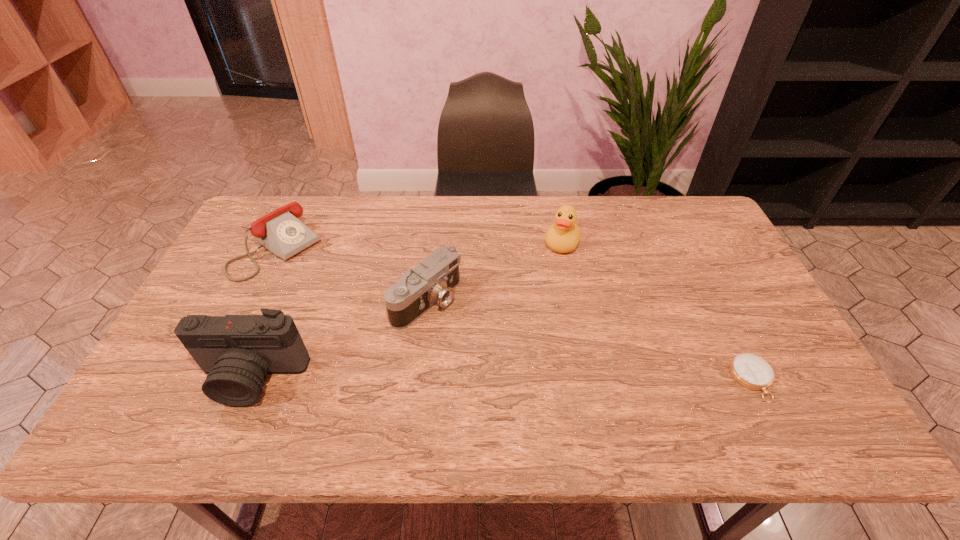
This screenshot has width=960, height=540. I want to click on vacant area at the left edge, so click(232, 274).

The width and height of the screenshot is (960, 540). Find the location of `free spot at the right edge of the desktop`. free spot at the right edge of the desktop is located at coordinates (729, 333).

Identify the location of free space at the far left corner of the desktop. This screenshot has width=960, height=540. (272, 196).

Where is `vacant point located between the shortest object and the farther camera`? Image resolution: width=960 pixels, height=540 pixels. vacant point located between the shortest object and the farther camera is located at coordinates (589, 340).

You are a GUI agent. You are given a task and a screenshot of the screen. Output one action in this format:
    pyautogui.click(x=<x>, y=<y>)
    Task: Click on the vacant area that lies between the third object from right to left and the telephone
    The width and height of the screenshot is (960, 540).
    Given the screenshot: What is the action you would take?
    pyautogui.click(x=351, y=274)

This screenshot has height=540, width=960. In order to click on empty location between the second object from right to left and the right camera in this screenshot , I will do `click(494, 272)`.

I want to click on vacant space that's between the shortest object and the right camera, so click(589, 340).

This screenshot has width=960, height=540. I want to click on empty space that is in between the second object from right to left and the right camera, so click(494, 272).

Find the location of a particular element. empty location between the duck and the farther camera is located at coordinates (494, 272).

Where is `free area in between the compass and the right camera`? This screenshot has width=960, height=540. free area in between the compass and the right camera is located at coordinates (589, 340).